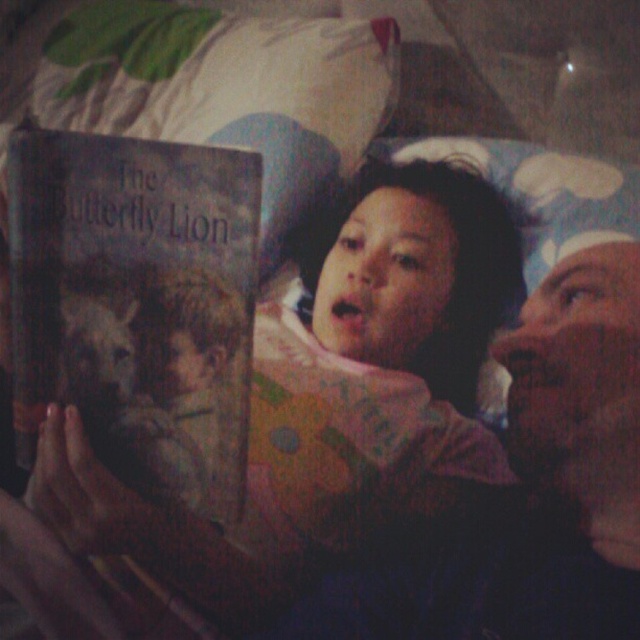
Question: Is hardcover book at center closer to the viewer compared to white fabric pillow at upper center?

Choices:
 (A) yes
 (B) no

Answer: (A)

Question: Which point is farther from the camera taking this photo?

Choices:
 (A) (620, 198)
 (B) (211, 83)
 (C) (145, 410)

Answer: (B)

Question: Which object is farther from the camera taking this photo?

Choices:
 (A) hardcover book at center
 (B) white fabric pillow at upper center
 (C) fluffy white pillow at upper center

Answer: (B)

Question: From the image, what is the correct spatial relationship of hardcover book at center in relation to fluffy white pillow at upper center?

Choices:
 (A) right
 (B) left

Answer: (B)

Question: Which point is closer to the camera?

Choices:
 (A) fluffy white pillow at upper center
 (B) white fabric pillow at upper center

Answer: (A)

Question: Does white fabric pillow at upper center have a smaller size compared to fluffy white pillow at upper center?

Choices:
 (A) yes
 (B) no

Answer: (B)